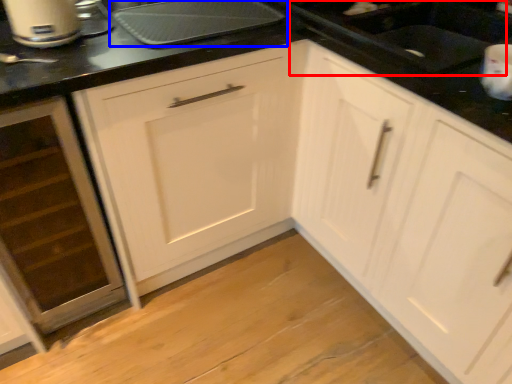
Question: Which object appears closest to the camera in this image, sink (highlighted by a red box) or kitchen appliance (highlighted by a blue box)?

Choices:
 (A) sink
 (B) kitchen appliance

Answer: (A)